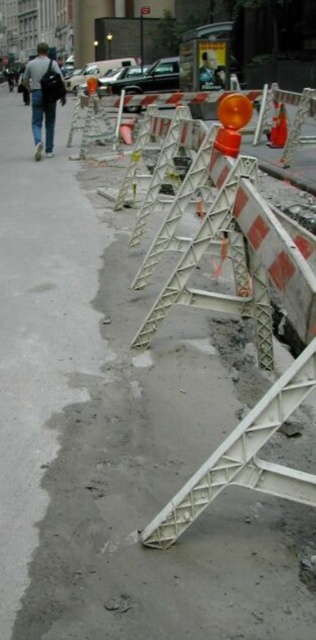
You are a delivery person who needs to place a new orange reflective cone at center next to the light gray backpack at left. Can the backpack be moved to make space?

The light gray backpack at left has a larger size compared to orange reflective cone at center, so moving the backpack would require more space but since it is already placed at the left, there might be enough room to place the cone next to it depending on the available space around.

You are a delivery drone flying over the construction site. You need to drop a package at the light gray backpack at left. What is the 2D coordinate where you should drop the package?

The light gray backpack at left is located at the 2D coordinate point of (43, 97), so you should drop the package there.

You are a delivery person who needs to place the light gray backpack at left into a storage bin that can only hold items narrower than the orange reflective cone at center. Can the backpack fit?

The light gray backpack at left might be wider than orange reflective cone at center, so it may not fit in the storage bin.